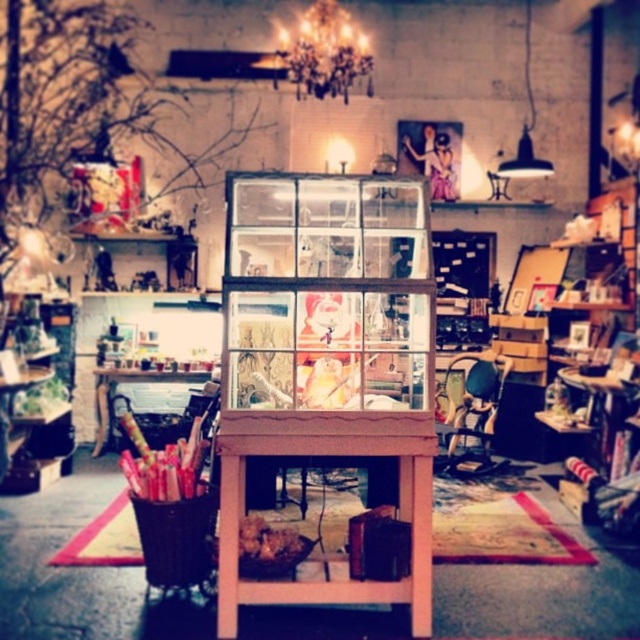
Question: Which of the following is the closest to the observer?

Choices:
 (A) (428, 401)
 (B) (218, 440)

Answer: (B)

Question: Which of the following is the closest to the observer?

Choices:
 (A) clear plastic cabinet at center
 (B) pink wood table at center

Answer: (B)

Question: Does clear plastic cabinet at center come behind pink wood table at center?

Choices:
 (A) yes
 (B) no

Answer: (A)

Question: Is clear plastic cabinet at center positioned behind pink wood table at center?

Choices:
 (A) yes
 (B) no

Answer: (A)

Question: Observing the image, what is the correct spatial positioning of clear plastic cabinet at center in reference to pink wood table at center?

Choices:
 (A) above
 (B) below

Answer: (A)